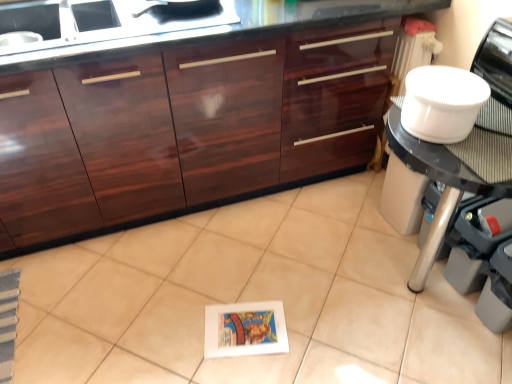
You are a GUI agent. You are given a task and a screenshot of the screen. Output one action in this format:
    pyautogui.click(x=<x>, y=<y>)
    Task: Click on the vacant point above white paper book at center (from a real-world perspective)
    This screenshot has width=512, height=384.
    Given the screenshot: What is the action you would take?
    pyautogui.click(x=248, y=326)